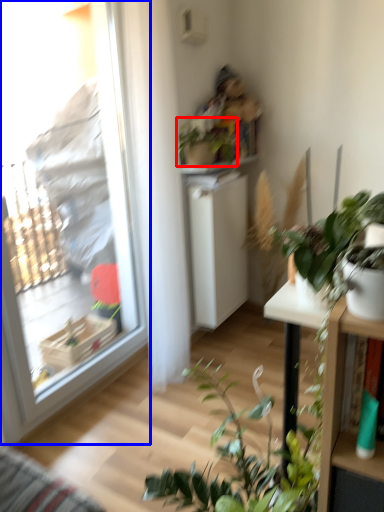
Question: Which object appears farthest to the camera in this image, houseplant (highlighted by a red box) or window (highlighted by a blue box)?

Choices:
 (A) houseplant
 (B) window

Answer: (A)